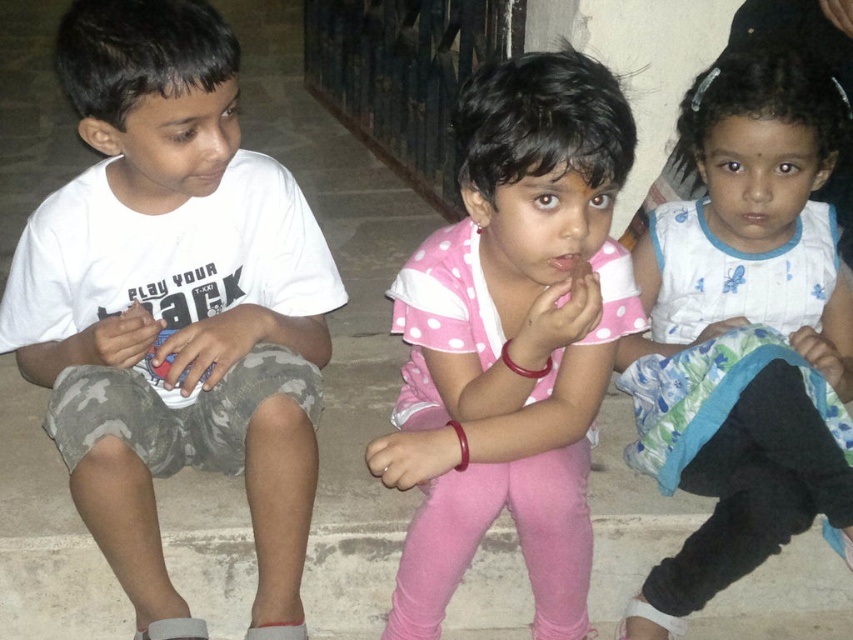
Question: Which point is farther to the camera?

Choices:
 (A) (590, 525)
 (B) (218, 413)
 (C) (643, 413)

Answer: (C)

Question: Which of these objects is positioned closest to the white dotted fabric at center?

Choices:
 (A) white cotton shirt at left
 (B) pink polka dot shirt at center

Answer: (B)

Question: Which point is closer to the camera taking this photo?

Choices:
 (A) (711, 291)
 (B) (73, 243)

Answer: (B)

Question: Is white cotton shirt at left to the right of pink polka dot shirt at center from the viewer's perspective?

Choices:
 (A) yes
 (B) no

Answer: (B)

Question: Does white cotton shirt at left appear over pink polka dot shirt at center?

Choices:
 (A) no
 (B) yes

Answer: (B)

Question: Considering the relative positions of white cotton shirt at left and pink polka dot shirt at center in the image provided, where is white cotton shirt at left located with respect to pink polka dot shirt at center?

Choices:
 (A) left
 (B) right

Answer: (A)